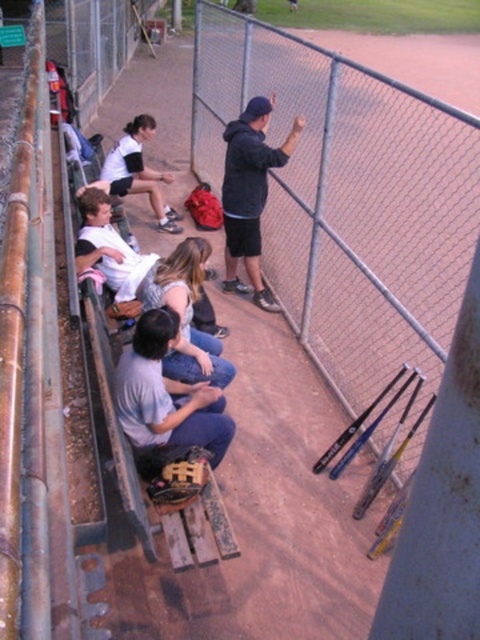
Question: Does white cotton shirt at center come in front of black matte bat at upper center?

Choices:
 (A) no
 (B) yes

Answer: (B)

Question: Is gray cotton shirt at center to the right of black matte bat at lower center from the viewer's perspective?

Choices:
 (A) no
 (B) yes

Answer: (A)

Question: Which of these objects is positioned closest to the black matte bat at upper center?

Choices:
 (A) denim jeans at center
 (B) white cotton shirt at center

Answer: (B)

Question: Does metal chain-link fence at center have a greater width compared to gray cotton shirt at center?

Choices:
 (A) no
 (B) yes

Answer: (B)

Question: Which of the following is the farthest from the observer?

Choices:
 (A) (81, 209)
 (B) (134, 339)
 (C) (332, 456)

Answer: (A)

Question: Among these points, which one is nearest to the camera?

Choices:
 (A) (273, 236)
 (B) (136, 419)
 (C) (211, 330)

Answer: (B)